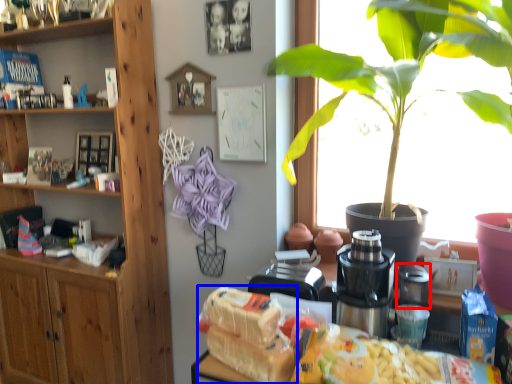
Question: Among these objects, which one is nearest to the camera, appliance (highlighted by a red box) or food (highlighted by a blue box)?

Choices:
 (A) appliance
 (B) food

Answer: (B)